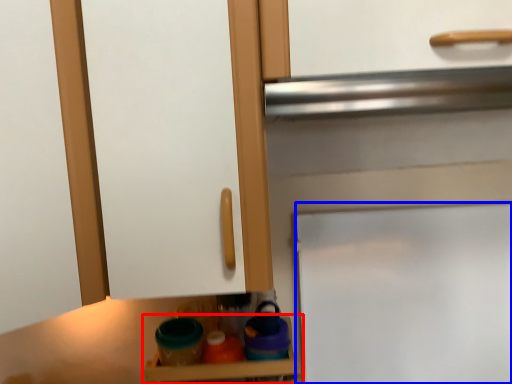
Question: Among these objects, which one is farthest to the camera, shelf (highlighted by a red box) or door (highlighted by a blue box)?

Choices:
 (A) shelf
 (B) door

Answer: (B)